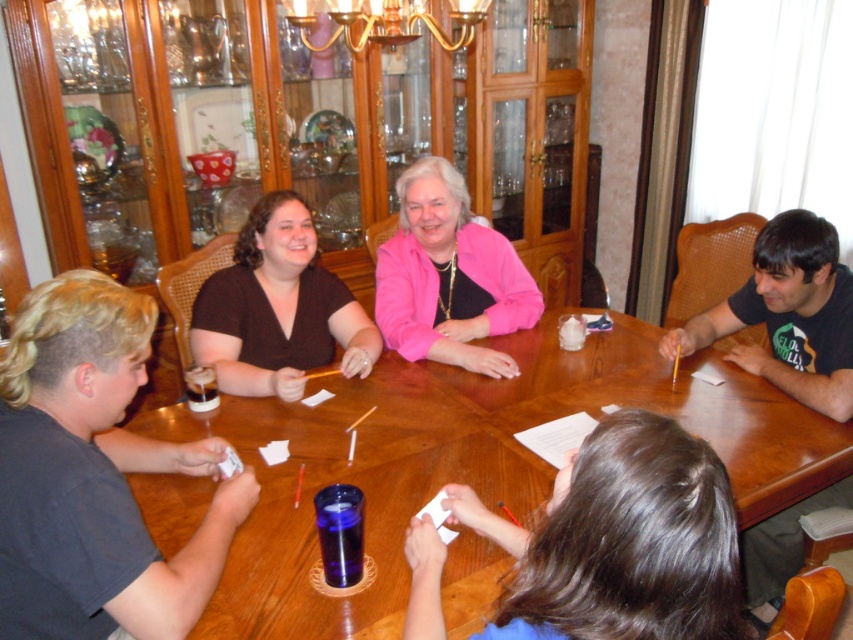
You are a photographer standing behind the dining table and want to take a photo of the brown hair at lower center and the pink matte jacket at center. Which object is closer to the camera?

The brown hair at lower center is closer to the camera because it is positioned below the pink matte jacket at center, meaning it is lower in the frame and thus nearer to the photographer standing behind the table.

You are standing at point 0.5, 0.5 in the room. Where is the wooden table at center located relative to your position?

The wooden table at center is located at point (x=469, y=460), which is to the northeast of your current position at (x=426, y=320).

You are a guest at this gathering and need to place a 1.5 meter long board game box on the wooden table at center. Considering the dark brown fabric shirt at upper left is worn by a person sitting at the table, can the box fit on the table?

The wooden table at center is wider than the dark brown fabric shirt at upper left. Since the shirt is part of a person sitting at the table, the table must be wider than the shirt, but the exact dimensions aren